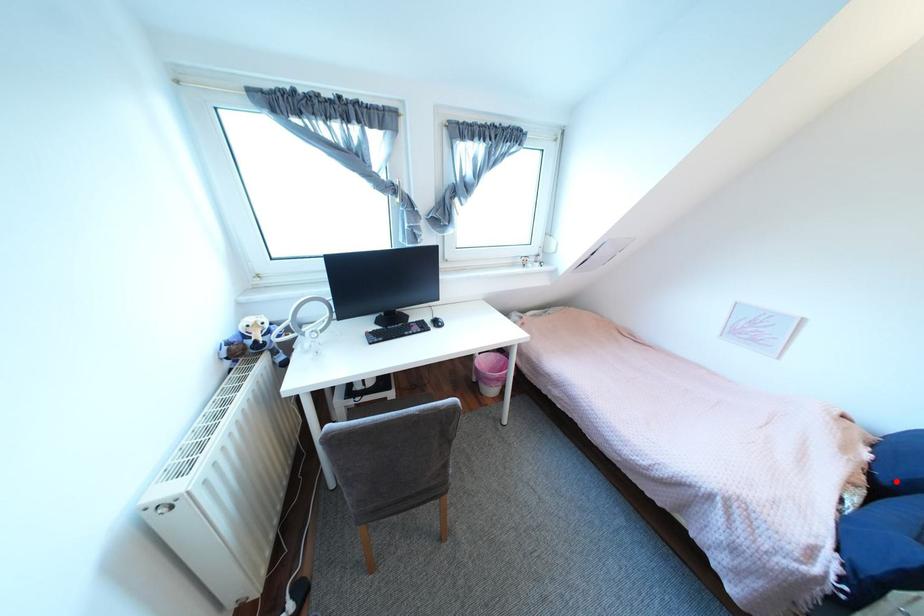
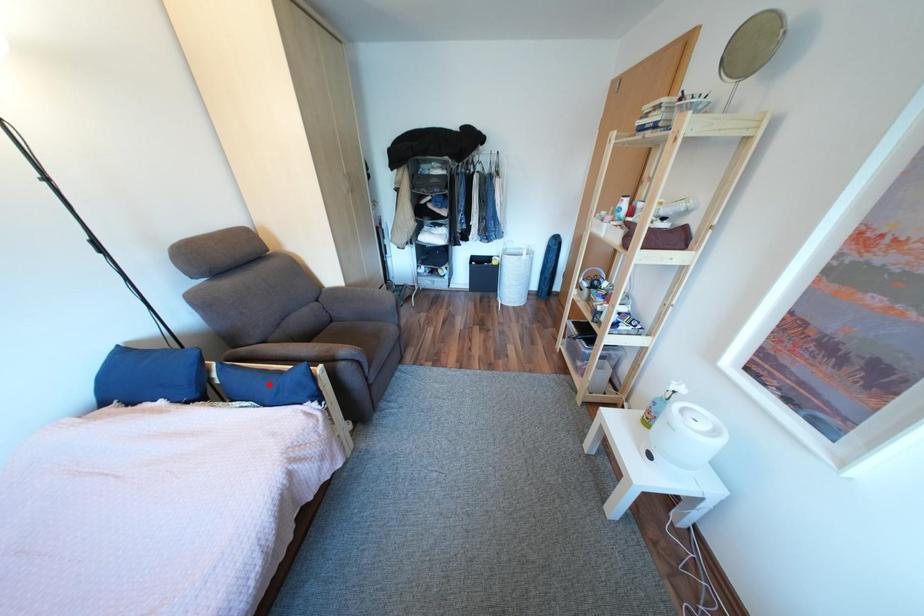
I am providing you with two images of the same scene from different viewpoints. A red point is marked on the first image and another point is marked on the second image. Does the point marked in image1 correspond to the same location as the one in image2?

No